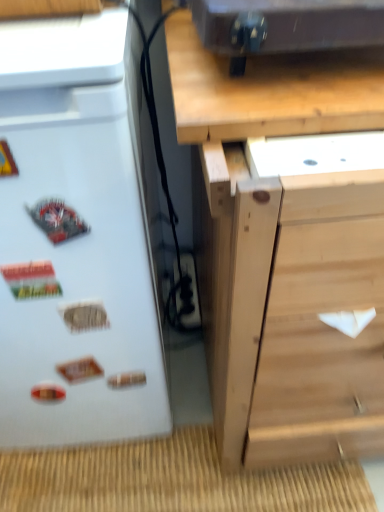
Question: From the image's perspective, would you say black plastic electric outlet at lower center is shown under white matte refrigerator at left?

Choices:
 (A) yes
 (B) no

Answer: (A)

Question: Is black plastic electric outlet at lower center behind white matte refrigerator at left?

Choices:
 (A) yes
 (B) no

Answer: (A)

Question: Is black plastic electric outlet at lower center closer to camera compared to white matte refrigerator at left?

Choices:
 (A) yes
 (B) no

Answer: (B)

Question: Is black plastic electric outlet at lower center smaller than white matte refrigerator at left?

Choices:
 (A) no
 (B) yes

Answer: (B)

Question: Can you confirm if black plastic electric outlet at lower center is bigger than white matte refrigerator at left?

Choices:
 (A) no
 (B) yes

Answer: (A)

Question: From a real-world perspective, is black plastic electric outlet at lower center below white matte refrigerator at left?

Choices:
 (A) yes
 (B) no

Answer: (A)

Question: Considering the relative sizes of metallic black speaker at upper center and natural wood chest of drawers at center in the image provided, is metallic black speaker at upper center bigger than natural wood chest of drawers at center?

Choices:
 (A) yes
 (B) no

Answer: (B)

Question: Is metallic black speaker at upper center facing towards natural wood chest of drawers at center?

Choices:
 (A) yes
 (B) no

Answer: (B)

Question: Considering the relative sizes of metallic black speaker at upper center and natural wood chest of drawers at center in the image provided, is metallic black speaker at upper center taller than natural wood chest of drawers at center?

Choices:
 (A) yes
 (B) no

Answer: (B)

Question: Considering the relative positions of metallic black speaker at upper center and natural wood chest of drawers at center in the image provided, is metallic black speaker at upper center to the left of natural wood chest of drawers at center from the viewer's perspective?

Choices:
 (A) no
 (B) yes

Answer: (B)

Question: Is the position of metallic black speaker at upper center less distant than that of natural wood chest of drawers at center?

Choices:
 (A) no
 (B) yes

Answer: (A)

Question: Is metallic black speaker at upper center thinner than natural wood chest of drawers at center?

Choices:
 (A) no
 (B) yes

Answer: (B)

Question: Is natural wood chest of drawers at center surrounding black plastic electric outlet at lower center?

Choices:
 (A) yes
 (B) no

Answer: (A)